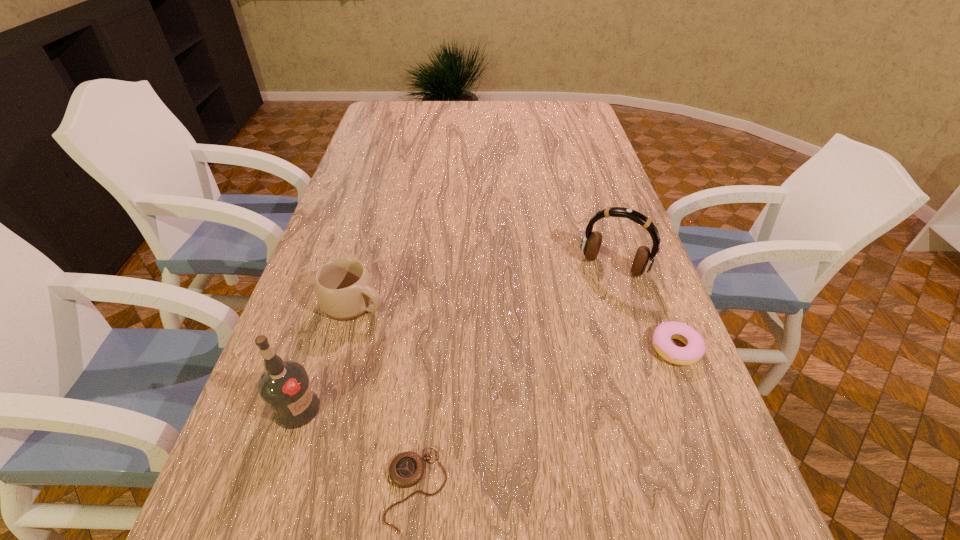
At what (x,y) coordinates should I click in order to perform the action: click on blank space at the far left corner. Please return your answer as a coordinate pair (x, y). Looking at the image, I should click on (400, 105).

Locate an element on the screen. blank space at the far right corner of the desktop is located at coordinates (566, 119).

The width and height of the screenshot is (960, 540). What are the coordinates of `vacant point located between the third farthest object and the headset` in the screenshot? It's located at (644, 307).

At what (x,y) coordinates should I click in order to perform the action: click on empty space that is in between the tallest object and the third farthest object. Please return your answer as a coordinate pair (x, y). Looking at the image, I should click on pyautogui.click(x=486, y=379).

At what (x,y) coordinates should I click in order to perform the action: click on vacant point located between the tallest object and the fourth tallest object. Please return your answer as a coordinate pair (x, y). Looking at the image, I should click on (486, 379).

Find the location of `vacant space in between the doughnut and the tallest object`. vacant space in between the doughnut and the tallest object is located at coordinates tap(486, 379).

You are a GUI agent. You are given a task and a screenshot of the screen. Output one action in this format:
    pyautogui.click(x=<x>, y=<y>)
    Task: Click on the vacant region between the third shortest object and the tallest object
    The width and height of the screenshot is (960, 540).
    Given the screenshot: What is the action you would take?
    pyautogui.click(x=326, y=356)

This screenshot has width=960, height=540. What are the coordinates of `vacant region between the mug and the farthest object` in the screenshot? It's located at (484, 285).

The height and width of the screenshot is (540, 960). I want to click on free space between the fourth nearest object and the vodka, so click(326, 356).

At what (x,y) coordinates should I click in order to perform the action: click on vacant space that is in between the doughnut and the mug. Please return your answer as a coordinate pair (x, y). This screenshot has height=540, width=960. Looking at the image, I should click on (515, 326).